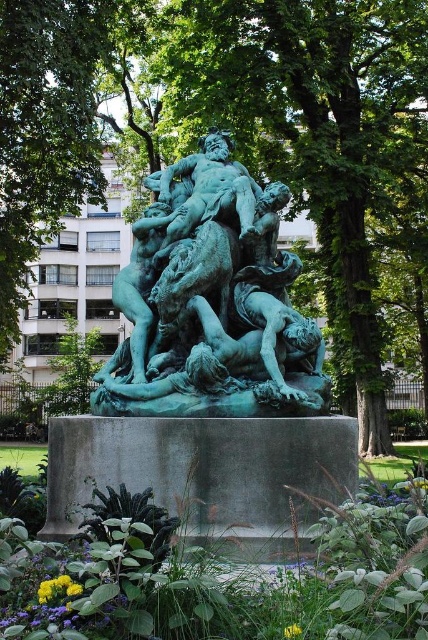
Question: Which point is closer to the camera?

Choices:
 (A) green patina statue at center
 (B) green stone statue at center

Answer: (B)

Question: Can you confirm if green patina statue at center is bigger than green stone statue at center?

Choices:
 (A) no
 (B) yes

Answer: (A)

Question: Considering the relative positions of green patina statue at center and green stone statue at center in the image provided, where is green patina statue at center located with respect to green stone statue at center?

Choices:
 (A) above
 (B) below

Answer: (A)

Question: Among these objects, which one is nearest to the camera?

Choices:
 (A) green stone statue at center
 (B) green patina statue at center

Answer: (A)

Question: Does green patina statue at center have a larger size compared to green stone statue at center?

Choices:
 (A) no
 (B) yes

Answer: (A)